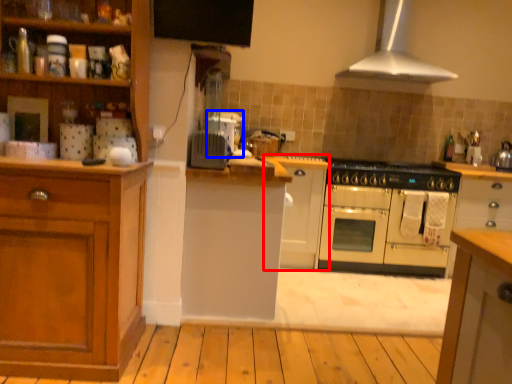
Question: Which object is further to the camera taking this photo, cabinetry (highlighted by a red box) or appliance (highlighted by a blue box)?

Choices:
 (A) cabinetry
 (B) appliance

Answer: (A)